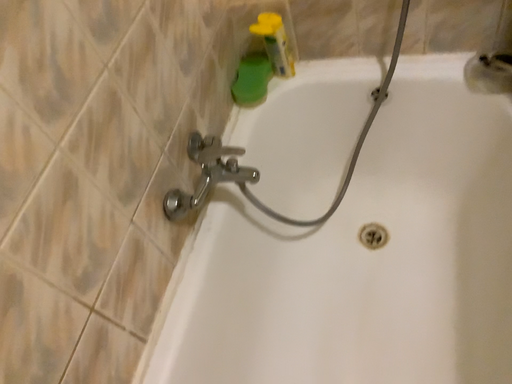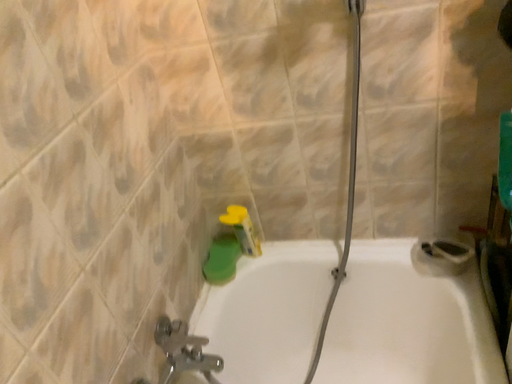
Question: How did the camera likely rotate when shooting the video?

Choices:
 (A) rotated upward
 (B) rotated downward

Answer: (A)